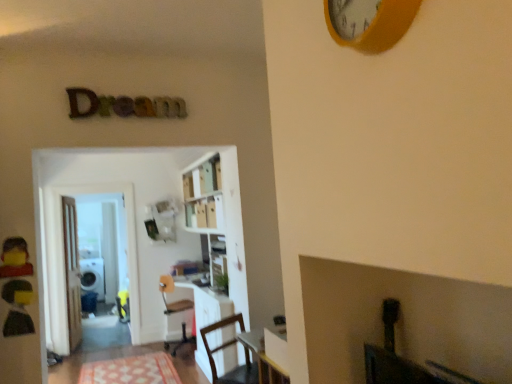
Question: Does yellow matte clock at upper center have a smaller size compared to white glossy bookcase at center?

Choices:
 (A) no
 (B) yes

Answer: (B)

Question: From a real-world perspective, is yellow matte clock at upper center physically below white glossy bookcase at center?

Choices:
 (A) no
 (B) yes

Answer: (A)

Question: Is yellow matte clock at upper center bigger than white glossy bookcase at center?

Choices:
 (A) no
 (B) yes

Answer: (A)

Question: Is yellow matte clock at upper center to the left of white glossy bookcase at center from the viewer's perspective?

Choices:
 (A) no
 (B) yes

Answer: (A)

Question: Is yellow matte clock at upper center aimed at white glossy bookcase at center?

Choices:
 (A) no
 (B) yes

Answer: (A)

Question: Looking at the image, does yellow matte clock at upper center seem bigger or smaller compared to wooden chair at lower center, marked as the first chair in a front-to-back arrangement?

Choices:
 (A) big
 (B) small

Answer: (B)

Question: Is yellow matte clock at upper center wider or thinner than wooden chair at lower center, acting as the 1th chair starting from the right?

Choices:
 (A) wide
 (B) thin

Answer: (B)

Question: Is yellow matte clock at upper center taller or shorter than wooden chair at lower center, marked as the first chair in a front-to-back arrangement?

Choices:
 (A) tall
 (B) short

Answer: (B)

Question: Does point (372, 29) appear closer or farther from the camera than point (243, 327)?

Choices:
 (A) farther
 (B) closer

Answer: (B)

Question: Is wooden door at left situated inside patterned fabric mat at lower center or outside?

Choices:
 (A) inside
 (B) outside

Answer: (B)

Question: Is wooden door at left wider or thinner than patterned fabric mat at lower center?

Choices:
 (A) wide
 (B) thin

Answer: (B)

Question: Considering the positions of wooden door at left and patterned fabric mat at lower center in the image, is wooden door at left taller or shorter than patterned fabric mat at lower center?

Choices:
 (A) short
 (B) tall

Answer: (B)

Question: From a real-world perspective, is wooden door at left physically located above or below patterned fabric mat at lower center?

Choices:
 (A) below
 (B) above

Answer: (B)

Question: Is point (368, 26) closer or farther from the camera than point (69, 190)?

Choices:
 (A) closer
 (B) farther

Answer: (A)

Question: From the image's perspective, is yellow matte clock at upper center located above or below transparent glass door at left?

Choices:
 (A) below
 (B) above

Answer: (B)